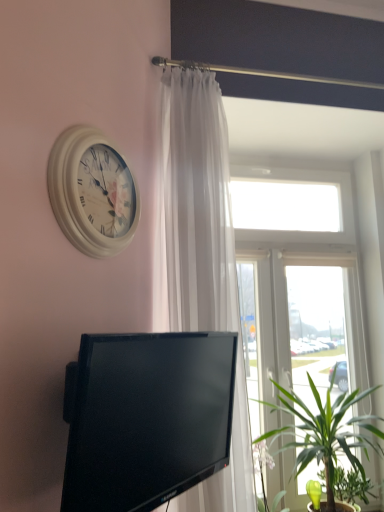
Question: Is point (258, 375) closer or farther from the camera than point (336, 483)?

Choices:
 (A) closer
 (B) farther

Answer: (B)

Question: Is transparent glass window at upper center wider or thinner than green leafy plant at lower right?

Choices:
 (A) wide
 (B) thin

Answer: (A)

Question: Estimate the real-world distances between objects in this image. Which object is closer to the white sheer curtain at upper center?

Choices:
 (A) transparent glass window at upper center
 (B) white wooden clock at upper left
 (C) green leafy plant at lower right
 (D) black glossy tv at lower center
 (E) green leafy plant at lower right

Answer: (D)

Question: Which is nearer to the transparent glass window at upper center?

Choices:
 (A) green leafy plant at lower right
 (B) white sheer curtain at upper center
 (C) white wooden clock at upper left
 (D) green leafy plant at lower right
 (E) black glossy tv at lower center

Answer: (A)